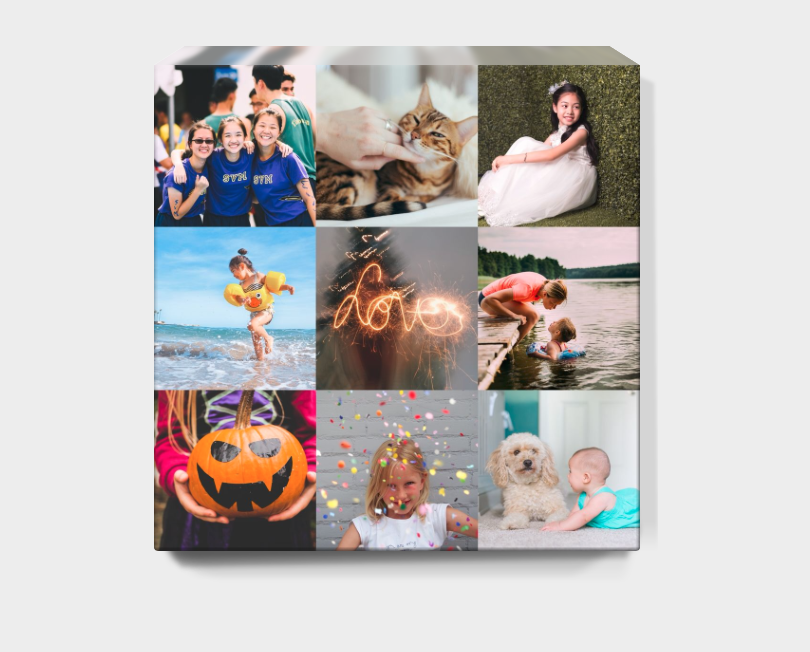
Where is `photographs`? The height and width of the screenshot is (652, 810). photographs is located at coordinates (227, 163), (397, 163), (561, 170), (538, 302), (365, 306), (228, 319), (265, 478), (416, 473), (556, 471).